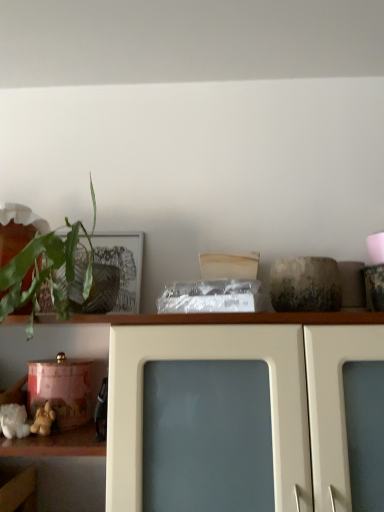
Question: Is point (77, 304) closer or farther from the camera than point (9, 446)?

Choices:
 (A) closer
 (B) farther

Answer: (B)

Question: From the image's perspective, relative to white glossy cabinet at upper center, is green leafy plant at left above or below?

Choices:
 (A) below
 (B) above

Answer: (B)

Question: Considering the real-world distances, which object is farthest from the white glossy cabinet at upper center?

Choices:
 (A) green leafy plant at left
 (B) soft yellow plush toy at lower left

Answer: (B)

Question: Which of these objects is positioned farthest from the white glossy cabinet at upper center?

Choices:
 (A) soft yellow plush toy at lower left
 (B) green leafy plant at left

Answer: (A)